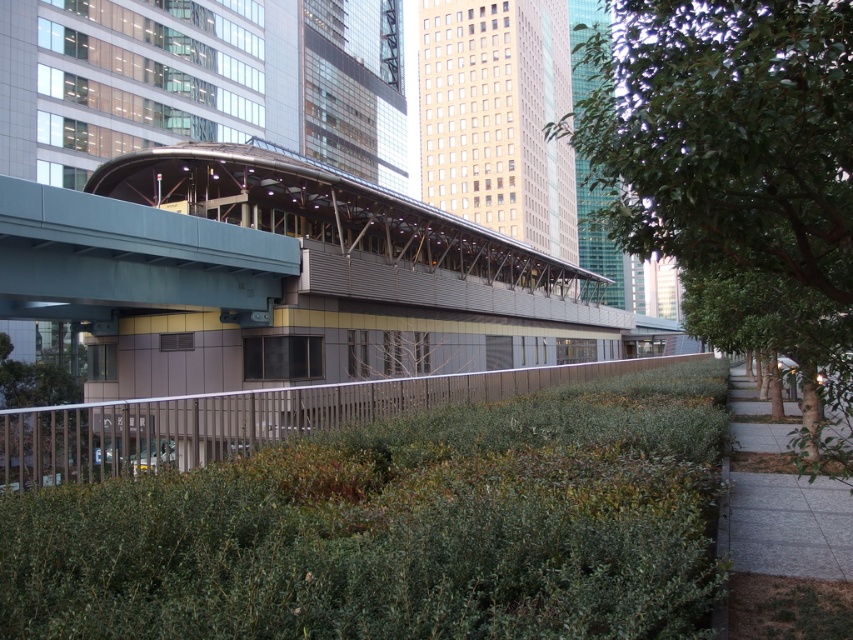
Is green leafy tree at right closer to the viewer compared to gray concrete sidewalk at lower right?

Yes, it is.

Does green leafy tree at right lie behind gray concrete sidewalk at lower right?

No, green leafy tree at right is in front of gray concrete sidewalk at lower right.

Between point (834, 36) and point (822, 536), which one is positioned in front?

Point (834, 36) is in front.

The image size is (853, 640). In order to click on green leafy tree at right in this screenshot , I will do `click(735, 170)`.

Looking at this image, who is taller, silver metallic rail at center or gray concrete sidewalk at lower right?

silver metallic rail at center is taller.

At what (x,y) coordinates should I click in order to perform the action: click on silver metallic rail at center. Please return your answer as a coordinate pair (x, y). This screenshot has height=640, width=853. Looking at the image, I should click on (242, 419).

The height and width of the screenshot is (640, 853). Find the location of `silver metallic rail at center`. silver metallic rail at center is located at coordinates (242, 419).

Does green leafy hedge at lower center appear under silver metallic rail at center?

Incorrect, green leafy hedge at lower center is not positioned below silver metallic rail at center.

Which is behind, point (276, 484) or point (62, 424)?

The point (62, 424) is more distant.

Identify the location of green leafy hedge at lower center. The width and height of the screenshot is (853, 640). (399, 528).